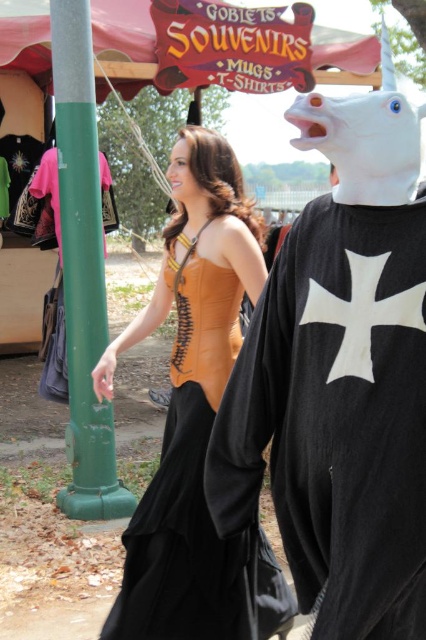
Question: Does white matte unicorn head at right have a greater width compared to leather-like orange corset at center?

Choices:
 (A) yes
 (B) no

Answer: (B)

Question: Does white matte unicorn head at right have a larger size compared to leather-like orange corset at center?

Choices:
 (A) yes
 (B) no

Answer: (B)

Question: Which of the following is the farthest from the observer?

Choices:
 (A) white matte unicorn head at right
 (B) leather-like orange corset at center

Answer: (B)

Question: Is white matte unicorn head at right closer to camera compared to leather-like orange corset at center?

Choices:
 (A) no
 (B) yes

Answer: (B)